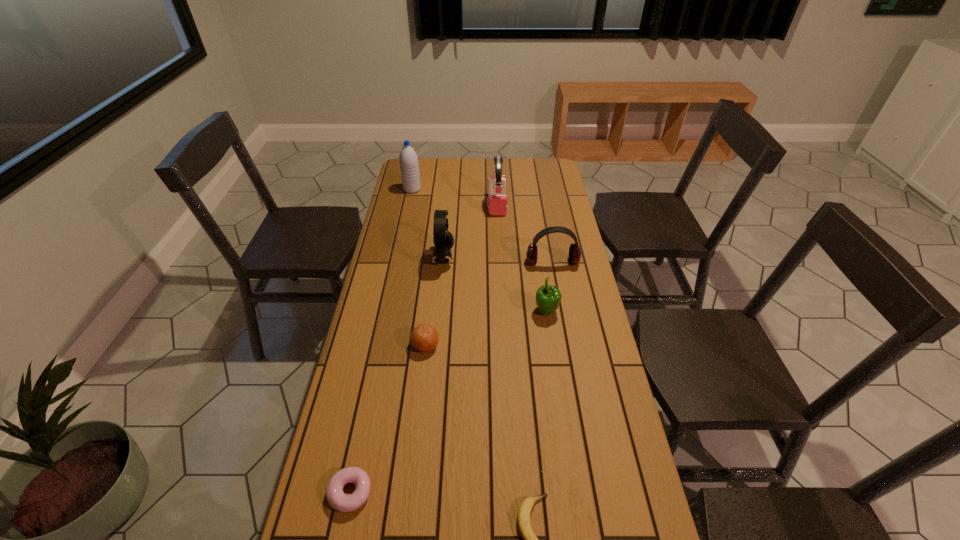
The height and width of the screenshot is (540, 960). I want to click on bell pepper that is at the right edge, so click(548, 297).

At what (x,y) coordinates should I click in order to perform the action: click on vacant space at the far edge. Please return your answer as a coordinate pair (x, y). Looking at the image, I should click on (516, 175).

Image resolution: width=960 pixels, height=540 pixels. In the image, there is a desktop. What are the coordinates of `vacant space at the left edge` in the screenshot? It's located at (343, 411).

Locate an element on the screen. Image resolution: width=960 pixels, height=540 pixels. vacant space at the right edge of the desktop is located at coordinates (576, 465).

The height and width of the screenshot is (540, 960). Identify the location of vacant region at the far right corner of the desktop. (525, 170).

At what (x,y) coordinates should I click in order to perform the action: click on free space between the bell pepper and the doughnut. Please return your answer as a coordinate pair (x, y). Image resolution: width=960 pixels, height=540 pixels. Looking at the image, I should click on (448, 402).

You are a GUI agent. You are given a task and a screenshot of the screen. Output one action in this format:
    pyautogui.click(x=<x>, y=<y>)
    Task: Click on the empty space between the farthest earphone and the water bottle
    
    Given the screenshot: What is the action you would take?
    pyautogui.click(x=455, y=197)

Find the location of `free space between the water bottle and the bell pepper`. free space between the water bottle and the bell pepper is located at coordinates (479, 251).

At what (x,y) coordinates should I click in order to perform the action: click on vacant space in between the fifth tallest object and the clementine. Please return your answer as a coordinate pair (x, y). The width and height of the screenshot is (960, 540). Looking at the image, I should click on (486, 328).

This screenshot has height=540, width=960. Find the location of `empty space that is in between the leftmost earphone and the fifth tallest object`. empty space that is in between the leftmost earphone and the fifth tallest object is located at coordinates (494, 285).